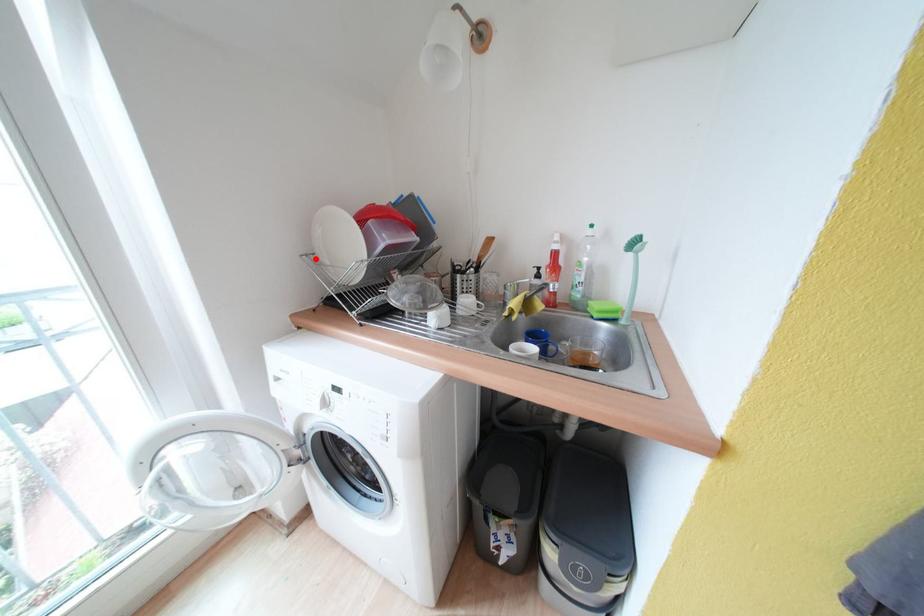
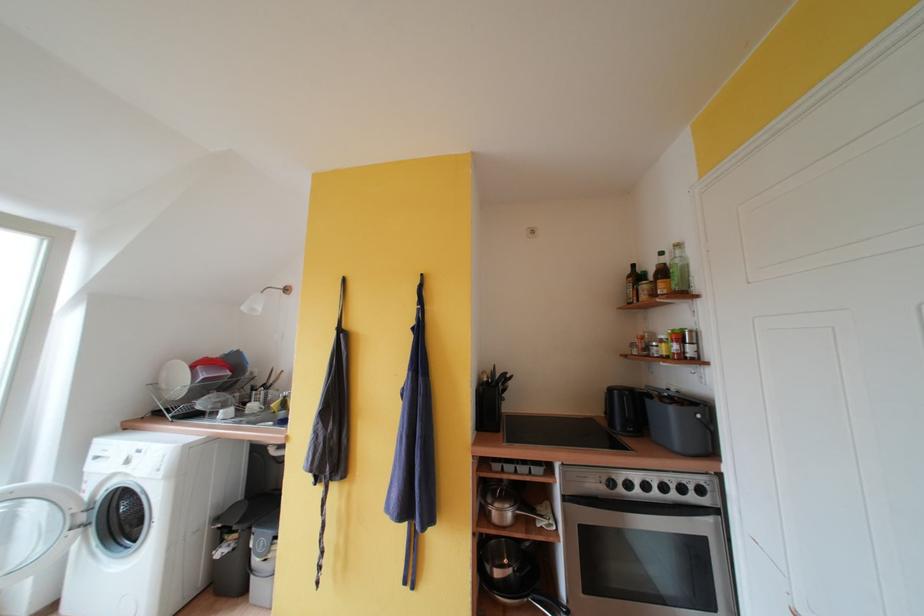
Find the pixel in the second image that matches the highlighted location in the first image.

(160, 387)